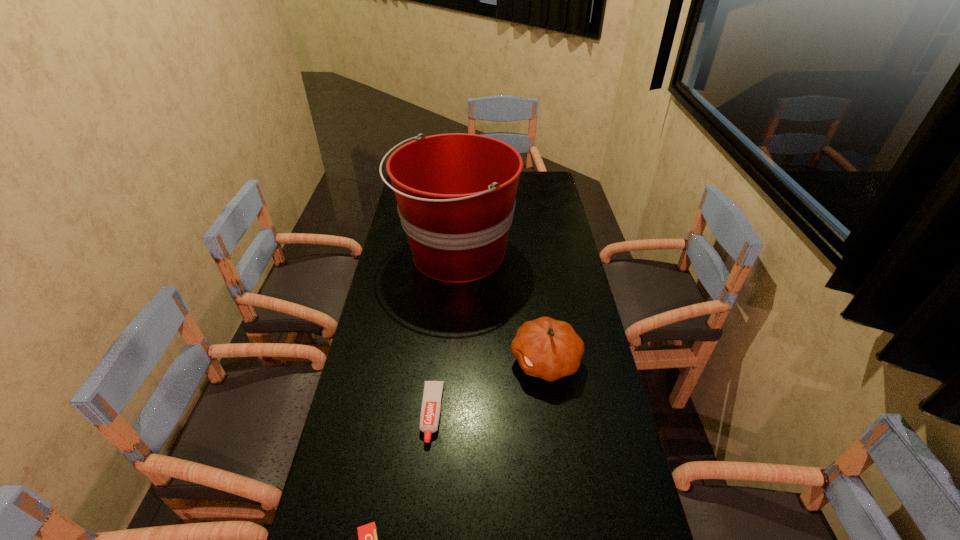
Find the location of `toothpaste that is the second closest to the tallest object`. toothpaste that is the second closest to the tallest object is located at coordinates (367, 534).

Locate which toothpaste is the closest to the second tallest object. Please provide its 2D coordinates. Your answer should be formatted as a tuple, i.e. [(x, y)], where the tuple contains the x and y coordinates of a point satisfying the conditions above.

[(431, 403)]